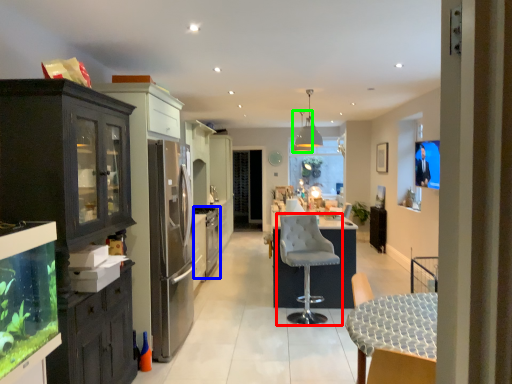
Question: Considering the real-world distances, which object is closest to chair (highlighted by a red box)? appliance (highlighted by a blue box) or lamp (highlighted by a green box).

Choices:
 (A) appliance
 (B) lamp

Answer: (A)